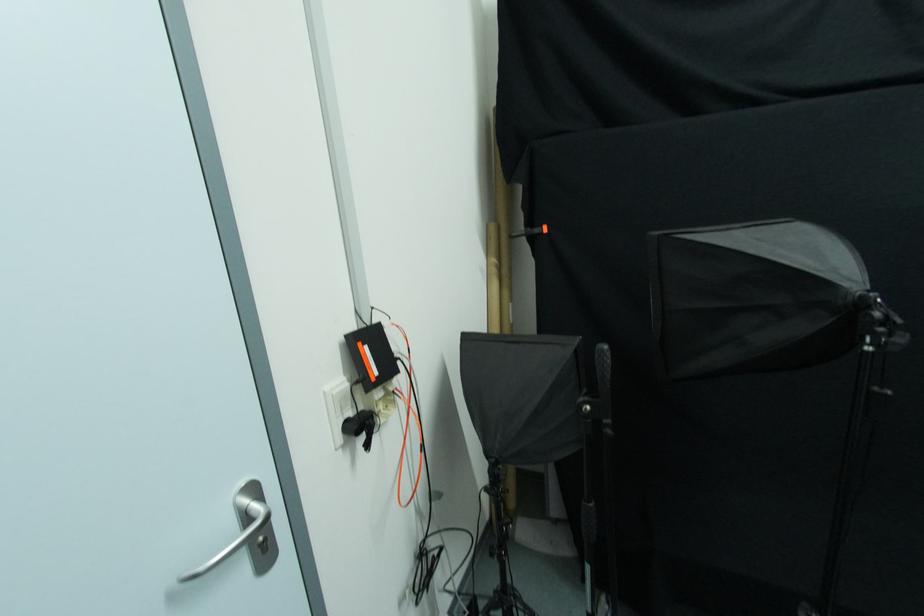
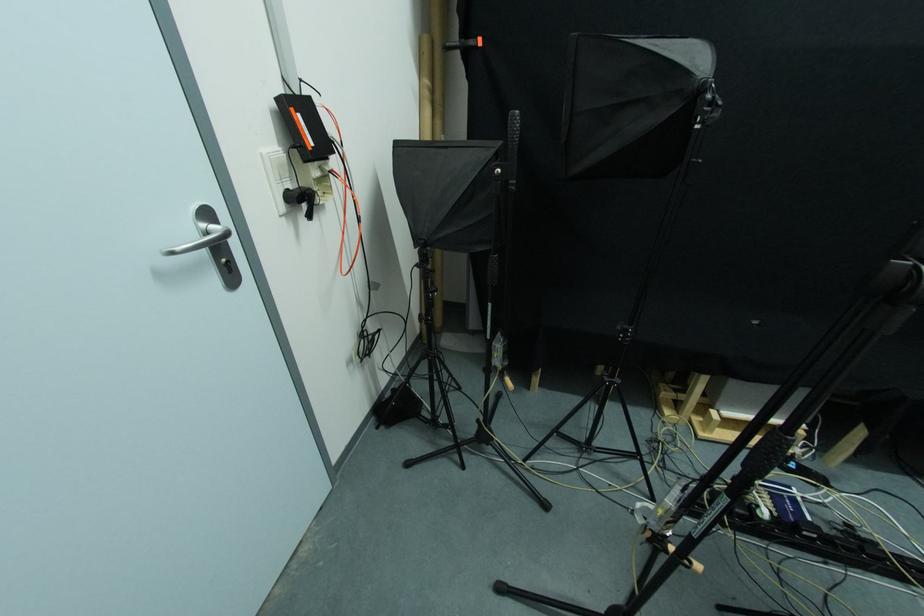
The point at (353, 416) is marked in the first image. Where is the corresponding point in the second image?

(292, 188)